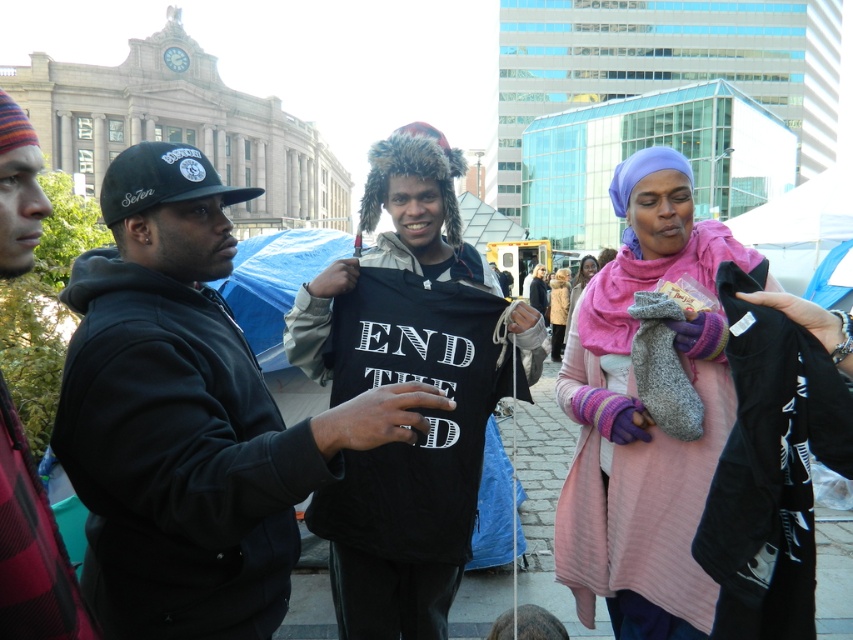
Who is lower down, pink woolen scarf at center or plaid fabric shirt at left?

pink woolen scarf at center is below.

Can you confirm if pink woolen scarf at center is positioned to the left of plaid fabric shirt at left?

In fact, pink woolen scarf at center is to the right of plaid fabric shirt at left.

You are a GUI agent. You are given a task and a screenshot of the screen. Output one action in this format:
    pyautogui.click(x=<x>, y=<y>)
    Task: Click on the pink woolen scarf at center
    The width and height of the screenshot is (853, 640).
    Given the screenshot: What is the action you would take?
    click(x=643, y=417)

Find the location of a particular element. Image resolution: width=853 pixels, height=640 pixels. pink woolen scarf at center is located at coordinates pos(643,417).

Does pink woolen scarf at center have a smaller size compared to pink fleece jacket at center?

Actually, pink woolen scarf at center might be larger than pink fleece jacket at center.

Which of these two, pink woolen scarf at center or pink fleece jacket at center, stands shorter?

With less height is pink fleece jacket at center.

Where is `pink woolen scarf at center`? The width and height of the screenshot is (853, 640). pink woolen scarf at center is located at coordinates (643, 417).

Between point (16, 541) and point (560, 273), which one is positioned in front?

Point (16, 541)

Which of these two, plaid fabric shirt at left or pink fleece jacket at center, stands shorter?

pink fleece jacket at center

This screenshot has width=853, height=640. Describe the element at coordinates (32, 547) in the screenshot. I see `plaid fabric shirt at left` at that location.

At what (x,y) coordinates should I click in order to perform the action: click on plaid fabric shirt at left. Please return your answer as a coordinate pair (x, y). Looking at the image, I should click on (32, 547).